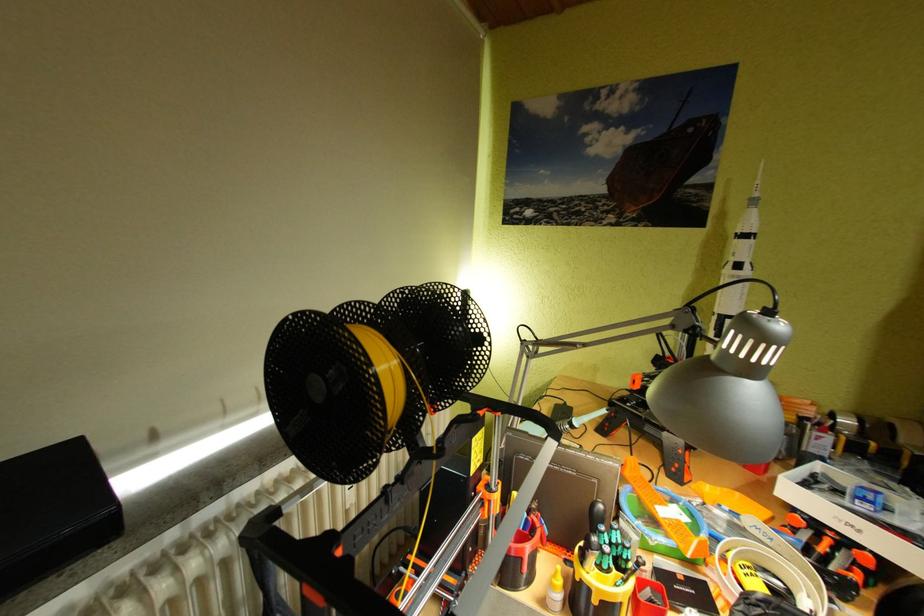
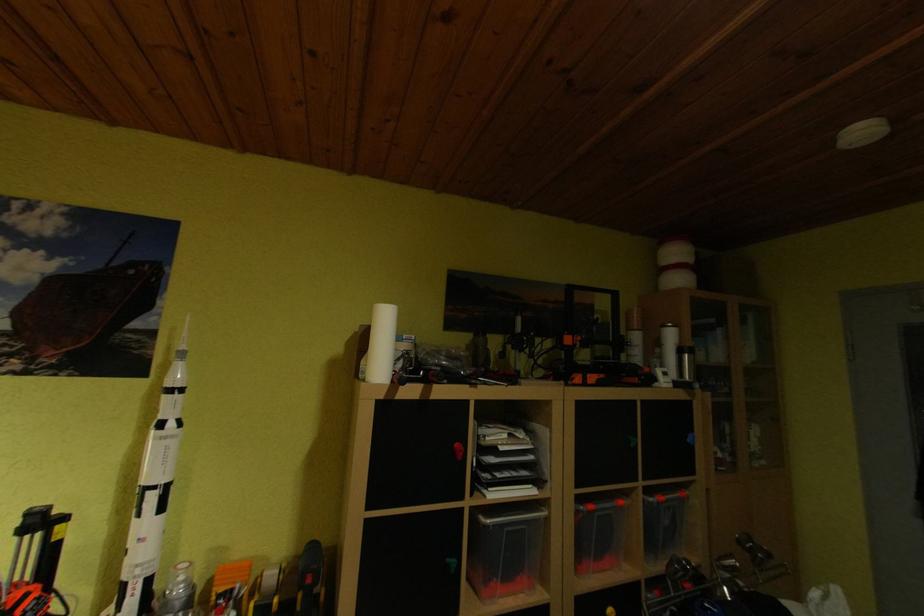
The first image is from the beginning of the video and the second image is from the end. How did the camera likely rotate when shooting the video?

The rotation direction of the camera is right-up.